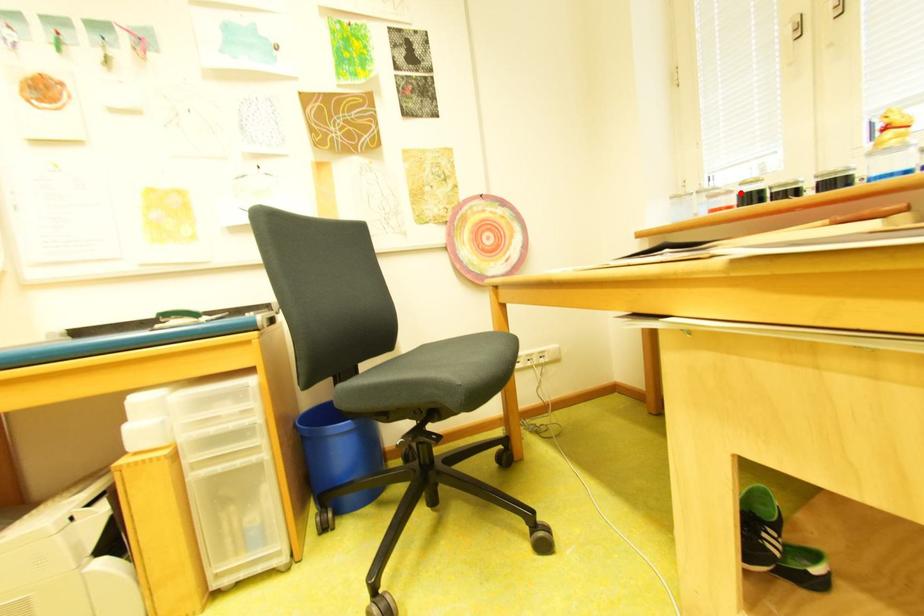
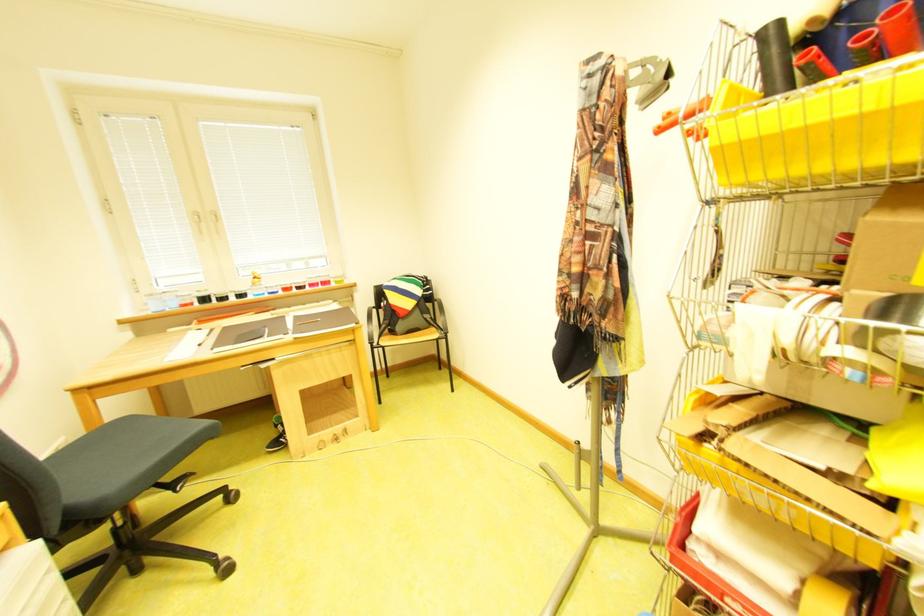
Question: I am providing you with two images of the same scene from different viewpoints. A red point is marked on the first image. Is the red point's position out of view in image 2?

Choices:
 (A) Yes
 (B) No

Answer: (B)